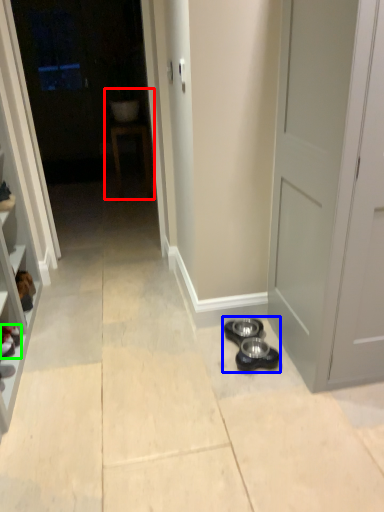
Question: Estimate the real-world distances between objects in this image. Which object is farther from sink (highlighted by a red box), shoe (highlighted by a blue box) or footwear (highlighted by a green box)?

Choices:
 (A) shoe
 (B) footwear

Answer: (A)